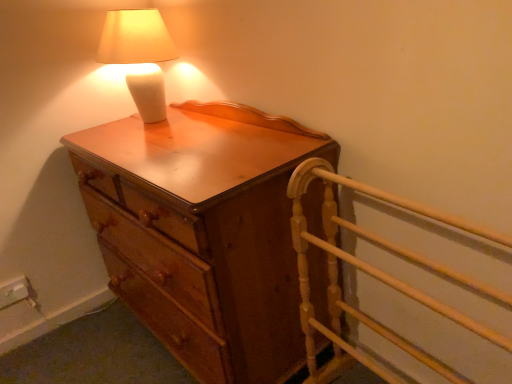
Where is `wooden chest of drawers at center`? The image size is (512, 384). wooden chest of drawers at center is located at coordinates pos(203,232).

The image size is (512, 384). What are the coordinates of `light wood bed frame at right` in the screenshot? It's located at 372,276.

The height and width of the screenshot is (384, 512). What are the coordinates of `wooden chest of drawers at center` in the screenshot? It's located at point(203,232).

Between light wood bed frame at right and wooden chest of drawers at center, which one is positioned behind?

Positioned behind is wooden chest of drawers at center.

What are the coordinates of `bed frame in front of the wooden chest of drawers at center` in the screenshot? It's located at (372, 276).

Who is shorter, light wood bed frame at right or wooden chest of drawers at center?

With less height is light wood bed frame at right.

Does light wood bed frame at right turn towards wooden chest of drawers at center?

No, light wood bed frame at right is not turned towards wooden chest of drawers at center.

Is wooden chest of drawers at center positioned behind light wood bed frame at right?

Yes, the depth of wooden chest of drawers at center is greater than that of light wood bed frame at right.

Is light wood bed frame at right at the back of wooden chest of drawers at center?

No.

Is wooden chest of drawers at center taller than light wood bed frame at right?

Yes.

In the scene shown: How different are the orientations of wooden chest of drawers at center and light wood bed frame at right in degrees?

They differ by 5.45 degrees in their facing directions.

From the picture: Which object is closer to the camera taking this photo, matte white lamp at upper left or wooden chest of drawers at center?

wooden chest of drawers at center is more forward.

Considering the relative sizes of matte white lamp at upper left and wooden chest of drawers at center in the image provided, is matte white lamp at upper left shorter than wooden chest of drawers at center?

Indeed, matte white lamp at upper left has a lesser height compared to wooden chest of drawers at center.

From a real-world perspective, which is physically above, matte white lamp at upper left or wooden chest of drawers at center?

From a 3D spatial view, matte white lamp at upper left is above.

Considering the sizes of objects light wood bed frame at right and matte white lamp at upper left in the image provided, who is shorter, light wood bed frame at right or matte white lamp at upper left?

matte white lamp at upper left.

How many degrees apart are the facing directions of light wood bed frame at right and matte white lamp at upper left?

The angle between the facing direction of light wood bed frame at right and the facing direction of matte white lamp at upper left is 3.84 degrees.

Is light wood bed frame at right positioned behind matte white lamp at upper left?

No, the depth of light wood bed frame at right is less than that of matte white lamp at upper left.

Is matte white lamp at upper left with light wood bed frame at right?

No, matte white lamp at upper left is not next to light wood bed frame at right.

Does matte white lamp at upper left lie in front of light wood bed frame at right?

No, the depth of matte white lamp at upper left is greater than that of light wood bed frame at right.

Considering the points (160, 45) and (294, 248), which point is behind, point (160, 45) or point (294, 248)?

The point (160, 45) is behind.

Is wooden chest of drawers at center looking in the opposite direction of matte white lamp at upper left?

No, matte white lamp at upper left is not at the back of wooden chest of drawers at center.

Locate an element on the screen. The width and height of the screenshot is (512, 384). lamp on the left of wooden chest of drawers at center is located at coordinates (139, 56).

Does wooden chest of drawers at center appear on the left side of matte white lamp at upper left?

No.

From the image's perspective, which object appears higher, wooden chest of drawers at center or matte white lamp at upper left?

matte white lamp at upper left appears higher in the image.

This screenshot has width=512, height=384. Identify the location of bed frame below the wooden chest of drawers at center (from the image's perspective). (x=372, y=276).

Identify the location of bed frame that appears in front of the wooden chest of drawers at center. This screenshot has width=512, height=384. (372, 276).

In the scene shown: From the image, which object appears to be nearer to matte white lamp at upper left, wooden chest of drawers at center or light wood bed frame at right?

The object closer to matte white lamp at upper left is wooden chest of drawers at center.

From the picture: From the image, which object appears to be nearer to matte white lamp at upper left, light wood bed frame at right or wooden chest of drawers at center?

wooden chest of drawers at center.

When comparing their distances from light wood bed frame at right, does matte white lamp at upper left or wooden chest of drawers at center seem closer?

wooden chest of drawers at center lies closer to light wood bed frame at right than the other object.

Estimate the real-world distances between objects in this image. Which object is further from light wood bed frame at right, wooden chest of drawers at center or matte white lamp at upper left?

Among the two, matte white lamp at upper left is located further to light wood bed frame at right.

Based on their spatial positions, is light wood bed frame at right or matte white lamp at upper left closer to wooden chest of drawers at center?

light wood bed frame at right is positioned closer to the anchor wooden chest of drawers at center.

When comparing their distances from wooden chest of drawers at center, does matte white lamp at upper left or light wood bed frame at right seem further?

matte white lamp at upper left is further to wooden chest of drawers at center.

The height and width of the screenshot is (384, 512). I want to click on chest of drawers between matte white lamp at upper left and light wood bed frame at right in the up-down direction, so click(x=203, y=232).